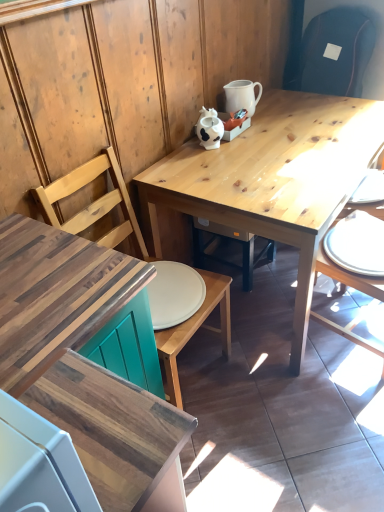
Identify the location of blank space situated above wooden desk at lower left (from a real-world perspective). This screenshot has height=512, width=384. (44, 275).